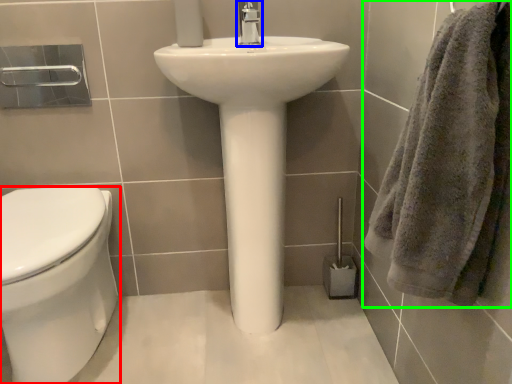
Question: Which object is positioned farthest from bidet (highlighted by a red box)? Select from tap (highlighted by a blue box) and towel (highlighted by a green box).

Choices:
 (A) tap
 (B) towel

Answer: (A)